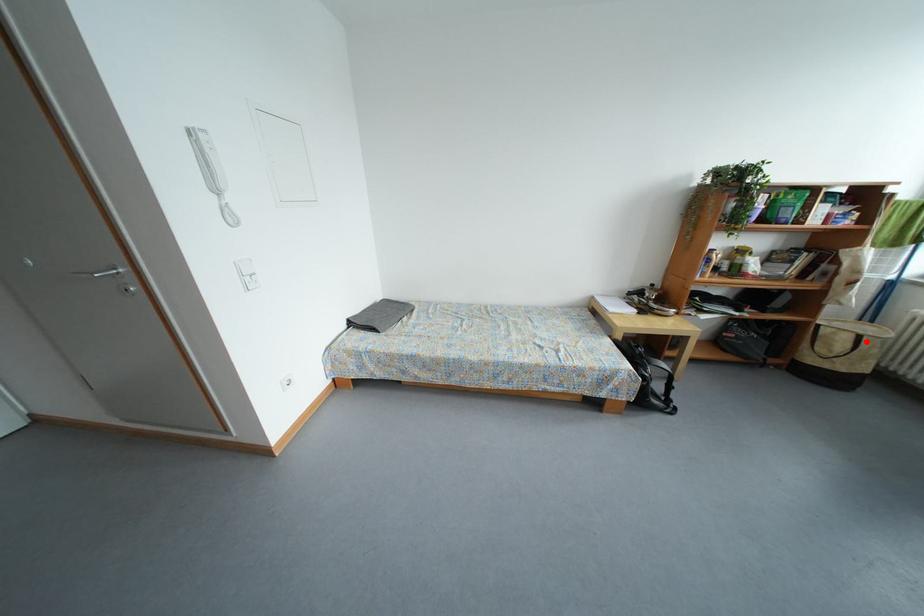
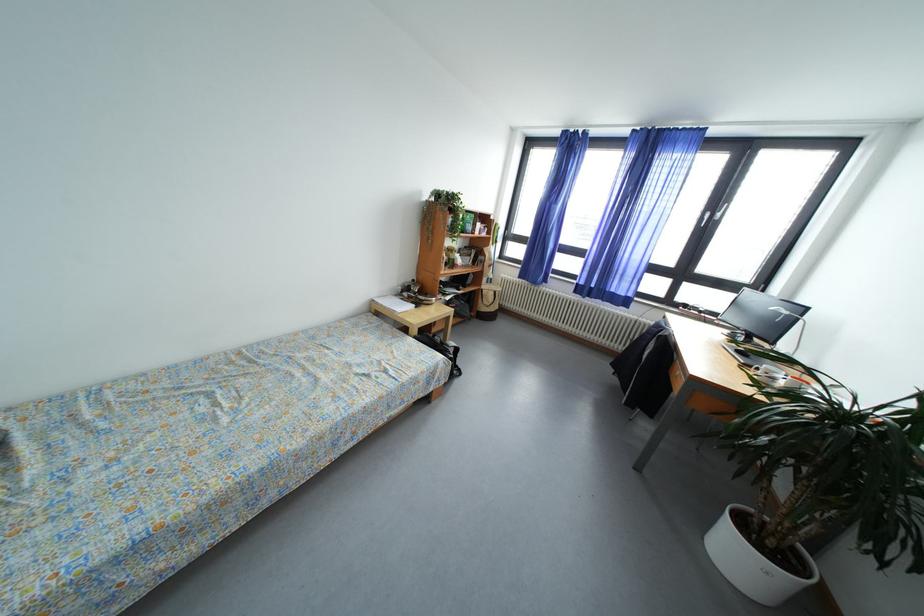
Where in the second image is the point corresponding to the highlighted location from the first image?

(502, 297)